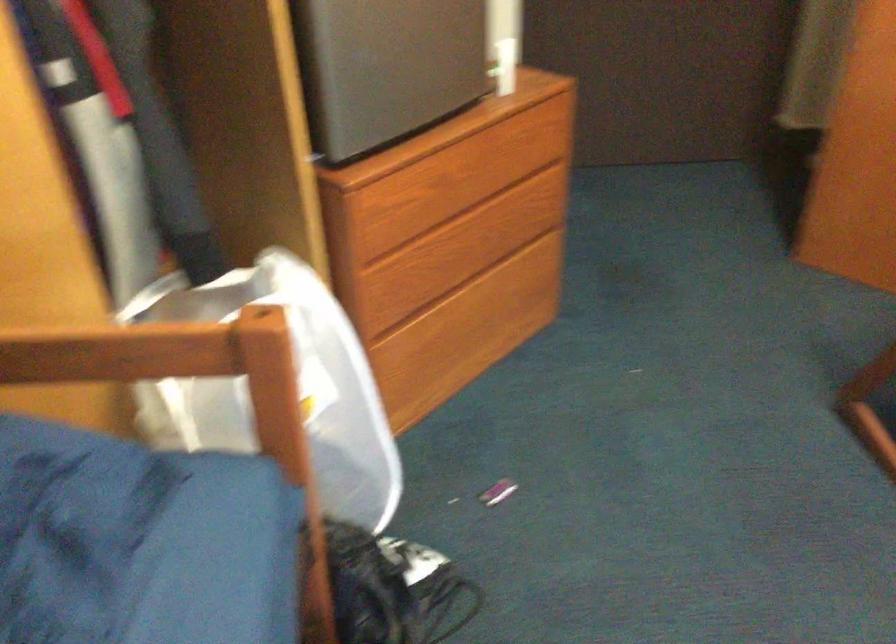
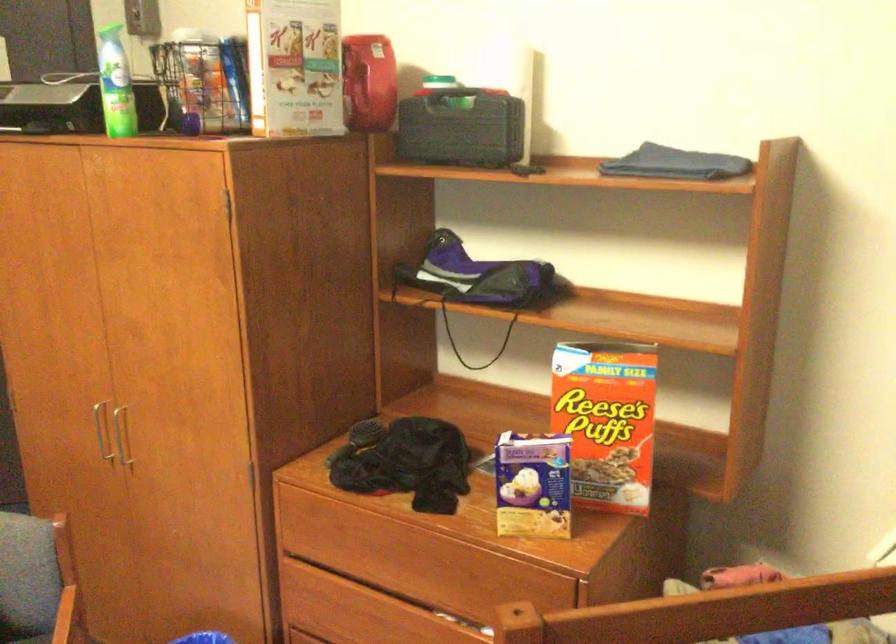
Question: The images are taken continuously from a first-person perspective. In which direction are you moving?

Choices:
 (A) Left
 (B) Right
 (C) Forward
 (D) Backward

Answer: (B)